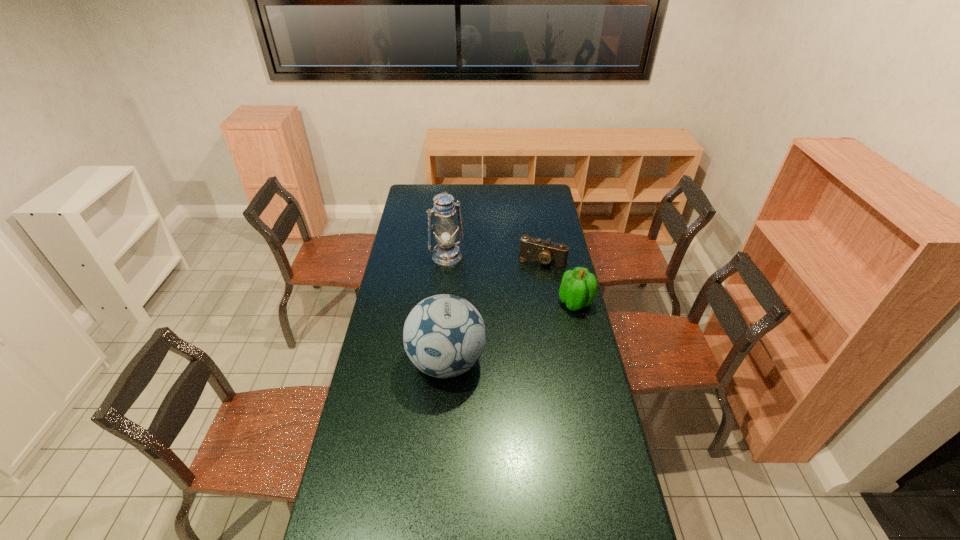
Identify the location of vacant space on the desktop that is between the soccer ball and the third tallest object and is positioned on the front-facing side of the tallest object. (505, 335).

I want to click on vacant space on the desktop that is between the nearest object and the second shortest object and is positioned on the front-facing side of the camera, so click(507, 334).